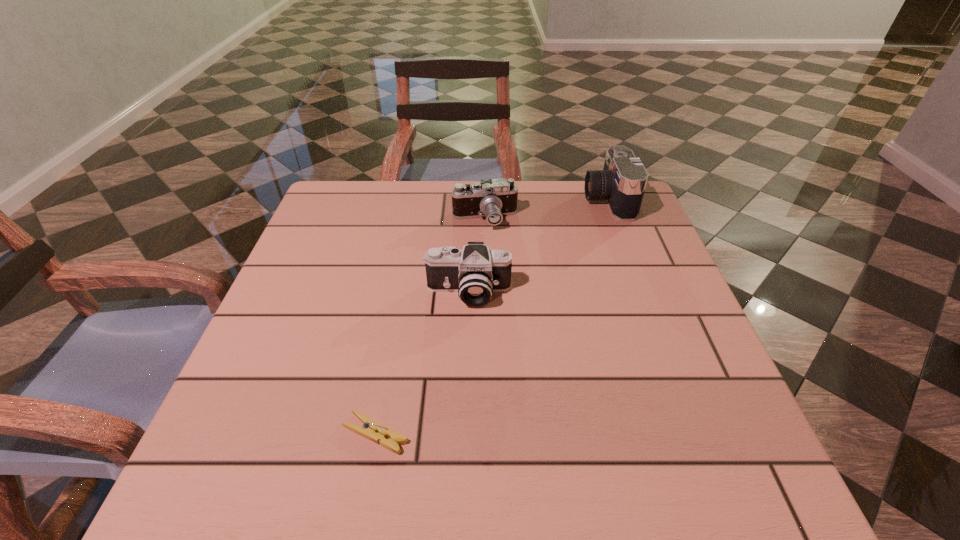
Locate an element on the screen. Image resolution: width=960 pixels, height=540 pixels. the rightmost object is located at coordinates (622, 182).

Locate an element on the screen. Image resolution: width=960 pixels, height=540 pixels. the third farthest object is located at coordinates (475, 272).

Identify the location of the second shortest object. (492, 198).

The width and height of the screenshot is (960, 540). I want to click on the shortest object, so click(372, 430).

You are a GUI agent. You are given a task and a screenshot of the screen. Output one action in this format:
    pyautogui.click(x=<x>, y=<y>)
    Task: Click on the nearest object
    Image resolution: width=960 pixels, height=540 pixels.
    Given the screenshot: What is the action you would take?
    pyautogui.click(x=372, y=430)

Locate an element on the screen. This screenshot has width=960, height=540. vacant point located on the front-facing side of the rightmost object is located at coordinates (508, 199).

Find the location of a particular element. The height and width of the screenshot is (540, 960). vacant area situated 0.190m on the front-facing side of the rightmost object is located at coordinates (515, 199).

This screenshot has width=960, height=540. Find the location of `vacant position located on the front-facing side of the rightmost object`. vacant position located on the front-facing side of the rightmost object is located at coordinates (511, 199).

Find the location of a particular element. The width and height of the screenshot is (960, 540). vacant space located on the back of the nearest camera is located at coordinates (471, 190).

Locate an element on the screen. Image resolution: width=960 pixels, height=540 pixels. vacant space situated 0.090m at the lens of the third tallest object is located at coordinates (486, 255).